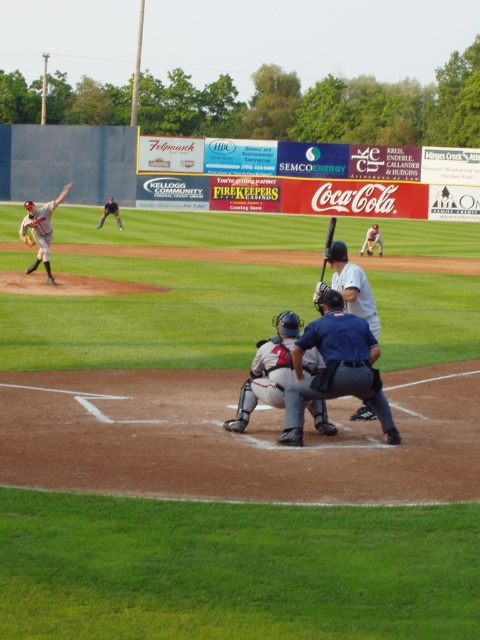
Is point (326, 374) less distant than point (52, 284)?

Yes, it is.

The image size is (480, 640). What do you see at coordinates (336, 369) in the screenshot?
I see `blue uniform at center` at bounding box center [336, 369].

Does point (346, 316) come farther from viewer compared to point (26, 208)?

No, it is not.

This screenshot has width=480, height=640. Find the location of `blue uniform at center`. blue uniform at center is located at coordinates point(336,369).

How distant is gray matte catcher at center from matte gray baseball glove at upper left?

gray matte catcher at center and matte gray baseball glove at upper left are 28.35 meters apart from each other.

Between gray matte catcher at center and matte gray baseball glove at upper left, which one is positioned higher?

matte gray baseball glove at upper left is above.

This screenshot has height=640, width=480. What are the coordinates of `gray matte catcher at center` in the screenshot? It's located at (267, 371).

Who is more forward, (374, 369) or (350, 284)?

Positioned in front is point (374, 369).

Who is positioned more to the right, blue uniform at center or white matte baseball bat at center?

Positioned to the right is white matte baseball bat at center.

Does point (294, 416) come closer to viewer compared to point (367, 417)?

Yes, point (294, 416) is closer to viewer.

Identify the location of blue uniform at center. (336, 369).